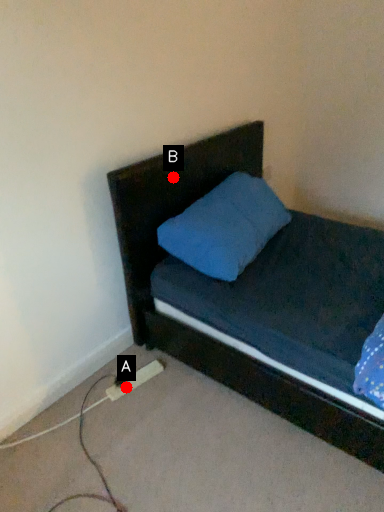
Question: Two points are circled on the image, labeled by A and B beside each circle. Among these points, which one is farthest from the camera?

Choices:
 (A) A is further
 (B) B is further

Answer: (A)